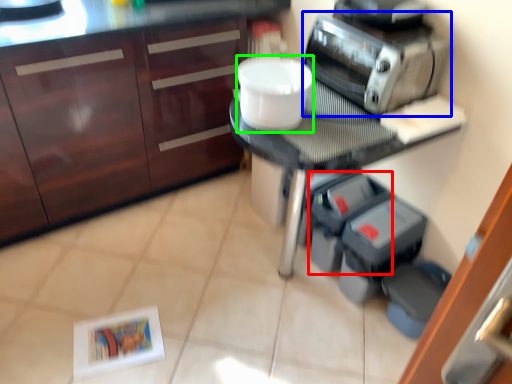
Question: Which object is the farthest from appliance (highlighted by a red box)? Choose among these: home appliance (highlighted by a blue box) or toilet bowl (highlighted by a green box).

Choices:
 (A) home appliance
 (B) toilet bowl

Answer: (B)